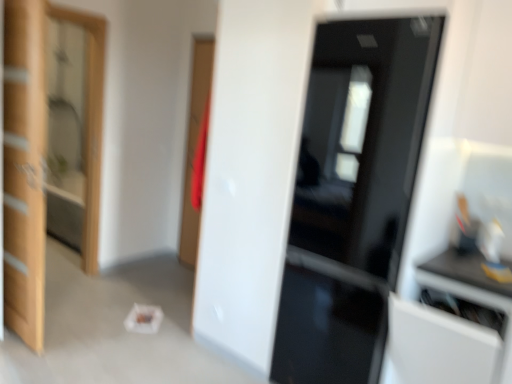
Question: Considering the relative sizes of wooden door at left, placed as the first door when sorted from left to right, and white glossy cabinet at right in the image provided, is wooden door at left, placed as the first door when sorted from left to right, thinner than white glossy cabinet at right?

Choices:
 (A) yes
 (B) no

Answer: (A)

Question: Is wooden door at left, placed as the first door when sorted from left to right, to the right of white glossy cabinet at right from the viewer's perspective?

Choices:
 (A) no
 (B) yes

Answer: (A)

Question: Does wooden door at left, which is the 2th door from right to left, have a greater height compared to white glossy cabinet at right?

Choices:
 (A) yes
 (B) no

Answer: (A)

Question: Is wooden door at left, which is the 2th door from right to left, in contact with white glossy cabinet at right?

Choices:
 (A) yes
 (B) no

Answer: (B)

Question: Is wooden door at left, placed as the first door when sorted from left to right, far away from white glossy cabinet at right?

Choices:
 (A) no
 (B) yes

Answer: (B)

Question: Is wooden door at left, which is the 2th door from right to left, in front of white glossy cabinet at right?

Choices:
 (A) no
 (B) yes

Answer: (A)

Question: Is white glossy cabinet at right in front of wooden door at left, placed as the first door when sorted from left to right?

Choices:
 (A) no
 (B) yes

Answer: (B)

Question: Is white glossy cabinet at right positioned with its back to wooden door at left, placed as the first door when sorted from left to right?

Choices:
 (A) yes
 (B) no

Answer: (B)

Question: Is white glossy cabinet at right shorter than wooden door at left, placed as the first door when sorted from left to right?

Choices:
 (A) no
 (B) yes

Answer: (B)

Question: Would you say white glossy cabinet at right is a long distance from wooden door at left, placed as the first door when sorted from left to right?

Choices:
 (A) no
 (B) yes

Answer: (B)

Question: Can you confirm if white glossy cabinet at right is positioned to the left of wooden door at left, which is the 2th door from right to left?

Choices:
 (A) no
 (B) yes

Answer: (A)

Question: From a real-world perspective, is white glossy cabinet at right below wooden door at left, placed as the first door when sorted from left to right?

Choices:
 (A) no
 (B) yes

Answer: (B)

Question: Can you confirm if glossy black door at center, which is counted as the second door, starting from the left, is positioned to the right of white glossy cabinet at right?

Choices:
 (A) yes
 (B) no

Answer: (B)